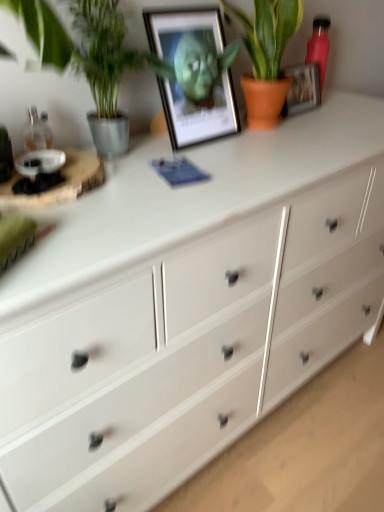
Question: From a real-world perspective, is metallic framed picture at upper center positioned above or below pink matte bottle at upper right?

Choices:
 (A) above
 (B) below

Answer: (A)

Question: Does point (193, 49) appear closer or farther from the camera than point (306, 46)?

Choices:
 (A) closer
 (B) farther

Answer: (A)

Question: Based on their relative distances, which object is nearer to the metallic framed picture at upper center?

Choices:
 (A) pink matte bottle at upper right
 (B) green leafy plant at left, which is the second houseplant in right-to-left order
 (C) terracotta pot plant at upper center, which is counted as the 1th houseplant, starting from the right

Answer: (B)

Question: Estimate the real-world distances between objects in this image. Which object is closer to the pink matte bottle at upper right?

Choices:
 (A) terracotta pot plant at upper center, which is counted as the 1th houseplant, starting from the right
 (B) green leafy plant at left, which is counted as the first houseplant, starting from the left
 (C) metallic framed picture at upper center

Answer: (A)